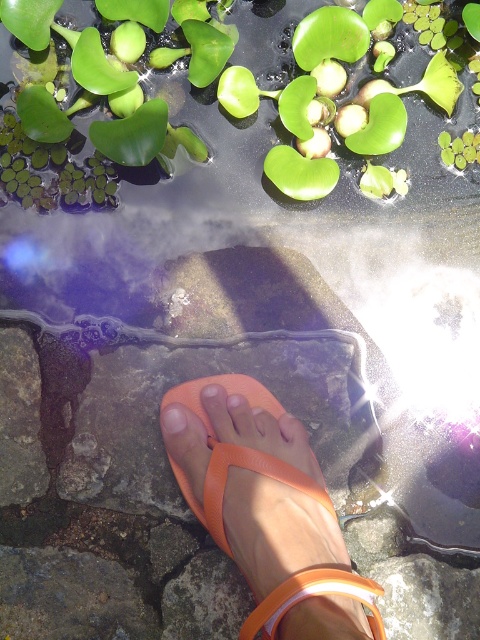
You are a photographer trying to capture the reflection of the green leafy plant at upper center and the pale skin at center in the water. Which object should you focus on first if you want to capture the reflection closest to the viewer?

The green leafy plant at upper center is positioned on the right side of pale skin at center, so focusing on the green leafy plant at upper center first would capture its reflection closest to the viewer since it is closer in the scene.

You are standing on a stone path near water and want to place a small item on the orange rubber sandal at center without it getting wet. Is the green leafy plant at upper center blocking the area where the sandal is?

The green leafy plant at upper center is positioned over orange rubber sandal at center, so placing the item there might get it wet due to the plant being above the sandal.